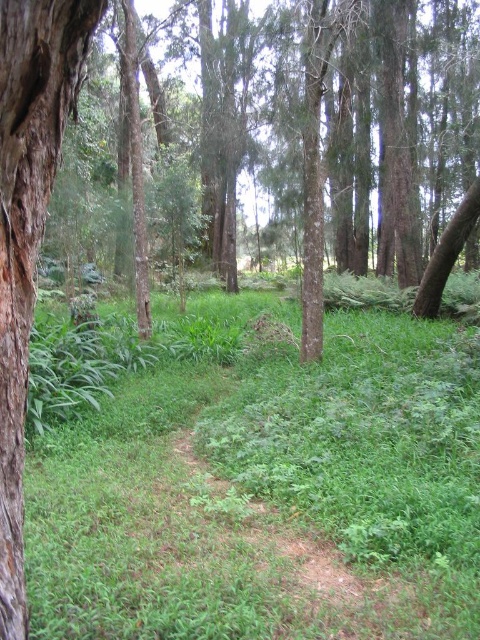
Who is lower down, green leafy grass at center or brown rough bark tree trunk at left?

Positioned lower is green leafy grass at center.

Which is more to the right, green leafy grass at center or brown rough bark tree trunk at left?

green leafy grass at center

Which is in front, point (387, 346) or point (19, 472)?

Point (19, 472)

Identify the location of green leafy grass at center. (266, 488).